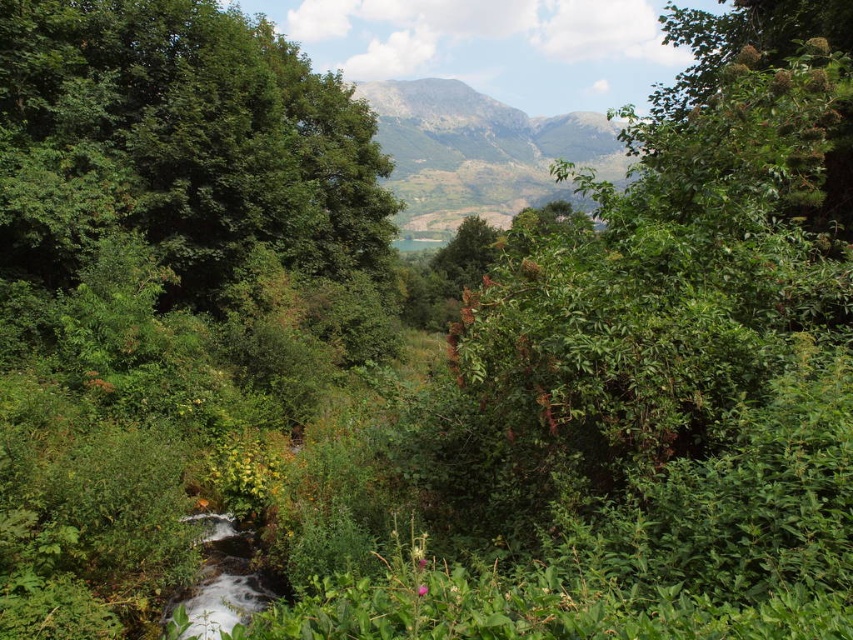
You are planning to take a photo of the green leafy tree at upper left and the gray rocky mountain at center. Which object will appear smaller in the photo?

The green leafy tree at upper left will appear smaller in the photo because it occupies less space than the gray rocky mountain at center according to the description.

You are a hiker planning to traverse from the green leafy tree at upper left to the gray rocky mountain at center. Given that your average walking speed is 3 km per hour, how long would it take you to reach the mountain?

The distance between the green leafy tree at upper left and the gray rocky mountain at center is 62.95 meters. Converting meters to kilometers, it is 0.06295 km. At a walking speed of 3 km per hour, the time required would be approximately 0.02098 hours, which is roughly 1.26 minutes. Therefore, it would take about 1 minute to reach the mountain.